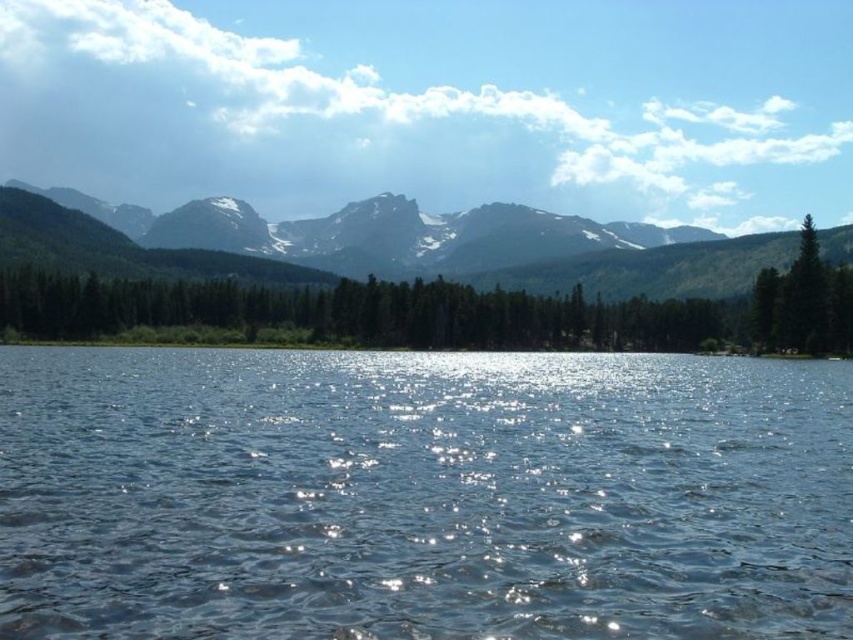
You are standing at the point marked as point (422,496) in the image. What is the most likely object you are standing on?

The clear water at center is located at point (422,496), so you are standing on the clear water at center.

You are an outdoor photographer planning to capture the reflection of the green matte trees at center and the sandy brown rock formation at upper center in the lake. Which object will have its reflection closer to the photographer?

The green matte trees at center are to the right of the sandy brown rock formation at upper center. Since reflections mirror the actual positions, the reflection of the green matte trees at center will be closer to the photographer as they are positioned further to the right compared to the rock formation.